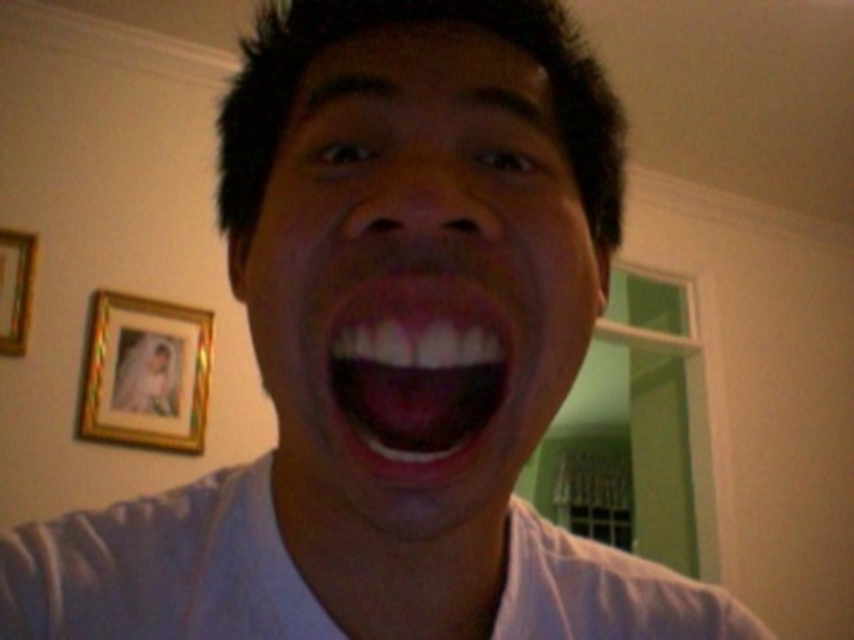
You are holding a small 12 inch ruler and want to measure the distance between yourself and the point at coordinates (15, 577) in the image. Can you reach it with your ruler?

The distance between you and the point at coordinates (15, 577) is 14.85 inches, which is longer than the 12 inch ruler you have. Therefore, you cannot reach it with your current ruler.

You are an artist trying to paint the scene. You notice the matte white face at center and the pink glossy lips at center. Which object is positioned to the left in the image?

The matte white face at center is to the left of the pink glossy lips at center.